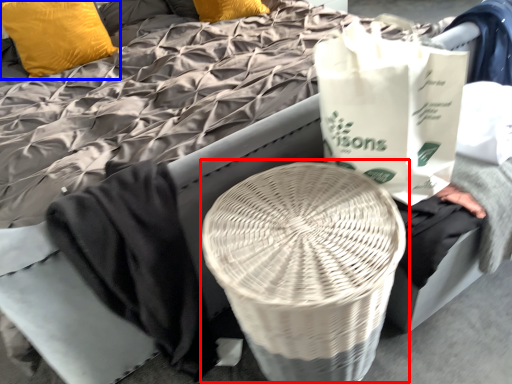
Question: Which object is closer to the camera taking this photo, round table (highlighted by a red box) or pillow (highlighted by a blue box)?

Choices:
 (A) round table
 (B) pillow

Answer: (A)